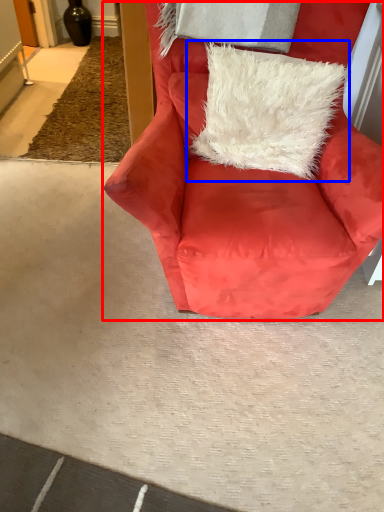
Question: Which object appears farthest to the camera in this image, chair (highlighted by a red box) or pillow (highlighted by a blue box)?

Choices:
 (A) chair
 (B) pillow

Answer: (B)